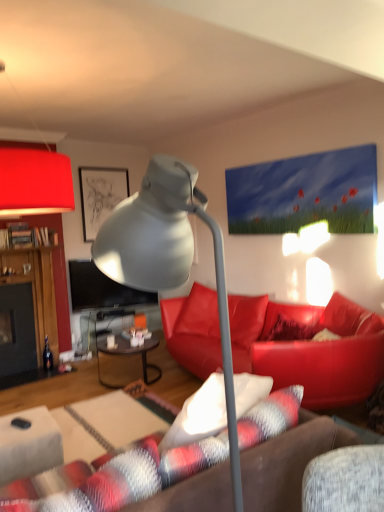
Question: Considering the relative sizes of matte gray lamp at center, the first lamp when ordered from bottom to top, and matte red lampshade at upper left, marked as the 1th lamp in a left-to-right arrangement, in the image provided, is matte gray lamp at center, the first lamp when ordered from bottom to top, thinner than matte red lampshade at upper left, marked as the 1th lamp in a left-to-right arrangement,?

Choices:
 (A) yes
 (B) no

Answer: (A)

Question: Is matte gray lamp at center, acting as the 1th lamp starting from the right, placed right next to matte red lampshade at upper left, positioned as the second lamp in right-to-left order?

Choices:
 (A) yes
 (B) no

Answer: (B)

Question: Is matte gray lamp at center, positioned as the second lamp in back-to-front order, further to the viewer compared to matte red lampshade at upper left, acting as the first lamp starting from the back?

Choices:
 (A) no
 (B) yes

Answer: (A)

Question: Can you confirm if matte gray lamp at center, the second lamp viewed from the top, is smaller than matte red lampshade at upper left, marked as the 1th lamp in a left-to-right arrangement?

Choices:
 (A) no
 (B) yes

Answer: (B)

Question: Is matte gray lamp at center, positioned as the second lamp in back-to-front order, wider than matte red lampshade at upper left, marked as the 1th lamp in a left-to-right arrangement?

Choices:
 (A) no
 (B) yes

Answer: (A)

Question: Considering their positions, is leather couch at center located in front of or behind matte red lampshade at upper left, the second lamp in the front-to-back sequence?

Choices:
 (A) behind
 (B) front

Answer: (A)

Question: Visually, is leather couch at center positioned to the left or to the right of matte red lampshade at upper left, marked as the 1th lamp in a left-to-right arrangement?

Choices:
 (A) left
 (B) right

Answer: (B)

Question: In terms of height, does leather couch at center look taller or shorter compared to matte red lampshade at upper left, marked as the 1th lamp in a left-to-right arrangement?

Choices:
 (A) tall
 (B) short

Answer: (B)

Question: Is leather couch at center inside or outside of matte red lampshade at upper left, the second lamp in the front-to-back sequence?

Choices:
 (A) outside
 (B) inside

Answer: (A)

Question: Considering their positions, is white fabric table at lower left, which is the first table in front-to-back order, located in front of or behind black rubberized corded phone at lower left?

Choices:
 (A) behind
 (B) front

Answer: (B)

Question: Choose the correct answer: Is white fabric table at lower left, the 2th table positioned from the back, inside black rubberized corded phone at lower left or outside it?

Choices:
 (A) inside
 (B) outside

Answer: (B)

Question: Does point (29, 429) appear closer or farther from the camera than point (19, 421)?

Choices:
 (A) farther
 (B) closer

Answer: (A)

Question: In terms of width, does white fabric table at lower left, the 2th table positioned from the back, look wider or thinner when compared to black rubberized corded phone at lower left?

Choices:
 (A) thin
 (B) wide

Answer: (B)

Question: From a real-world perspective, is black glass table at center, acting as the first table starting from the back, above or below matte black picture frame at upper left?

Choices:
 (A) above
 (B) below

Answer: (B)

Question: Considering the positions of point (135, 352) and point (115, 181), is point (135, 352) closer or farther from the camera than point (115, 181)?

Choices:
 (A) closer
 (B) farther

Answer: (A)